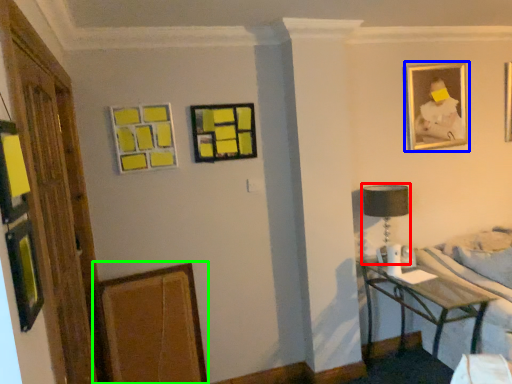
Question: Based on their relative distances, which object is nearer to table lamp (highlighted by a red box)? Choose from picture frame (highlighted by a blue box) and picture frame (highlighted by a green box).

Choices:
 (A) picture frame
 (B) picture frame

Answer: (A)